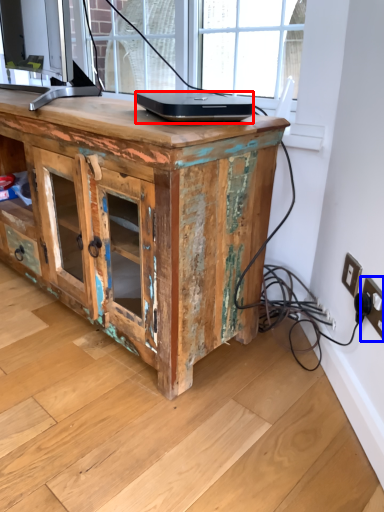
Question: Which object is further to the camera taking this photo, laptop (highlighted by a red box) or electric outlet (highlighted by a blue box)?

Choices:
 (A) laptop
 (B) electric outlet

Answer: (A)